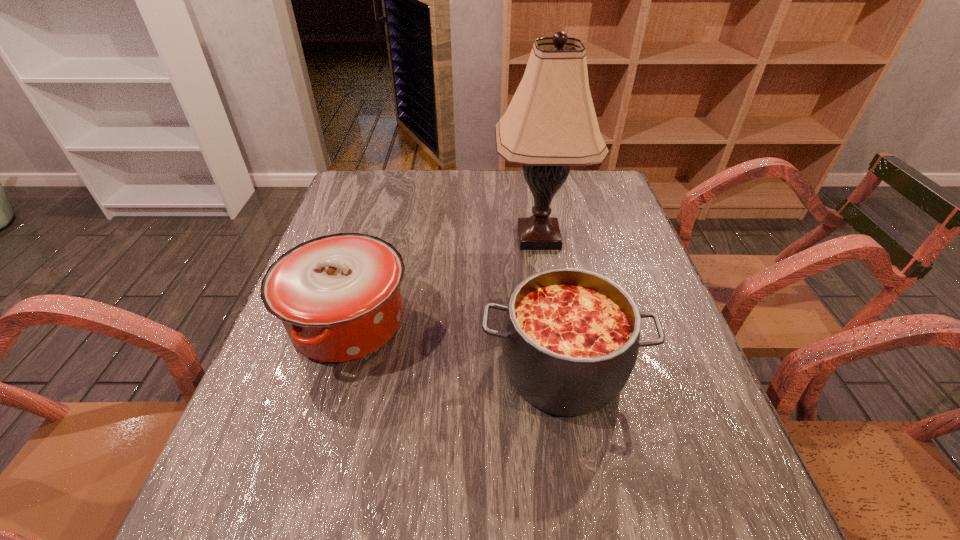
Where is `vacant area that lies between the farthest object and the left casserole`? The width and height of the screenshot is (960, 540). vacant area that lies between the farthest object and the left casserole is located at coordinates (444, 280).

This screenshot has height=540, width=960. I want to click on free area in between the left casserole and the lamp, so click(444, 280).

At what (x,y) coordinates should I click in order to perform the action: click on vacant area that lies between the right casserole and the left casserole. Please return your answer as a coordinate pair (x, y). This screenshot has height=540, width=960. Looking at the image, I should click on (455, 345).

You are a GUI agent. You are given a task and a screenshot of the screen. Output one action in this format:
    pyautogui.click(x=<x>, y=<y>)
    Task: Click on the free space that is in between the lamp and the left casserole
    The height and width of the screenshot is (540, 960).
    Given the screenshot: What is the action you would take?
    pyautogui.click(x=444, y=280)

Select which object appears as the second closest to the left casserole. Please provide its 2D coordinates. Your answer should be formatted as a tuple, i.e. [(x, y)], where the tuple contains the x and y coordinates of a point satisfying the conditions above.

[(550, 124)]

Select which object appears as the closest to the leftmost object. Please provide its 2D coordinates. Your answer should be formatted as a tuple, i.e. [(x, y)], where the tuple contains the x and y coordinates of a point satisfying the conditions above.

[(570, 338)]

Identify the location of free space that satisfies the following two spatial constraints: 1. on the front side of the right casserole; 2. on the left side of the lamp. (561, 368).

Where is `free space that satisfies the following two spatial constraints: 1. on the front side of the lamp; 2. on the left side of the right casserole`? The height and width of the screenshot is (540, 960). free space that satisfies the following two spatial constraints: 1. on the front side of the lamp; 2. on the left side of the right casserole is located at coordinates (561, 368).

This screenshot has height=540, width=960. In order to click on free space in the image that satisfies the following two spatial constraints: 1. on the front side of the right casserole; 2. on the right side of the leftmost object in this screenshot , I will do `click(334, 368)`.